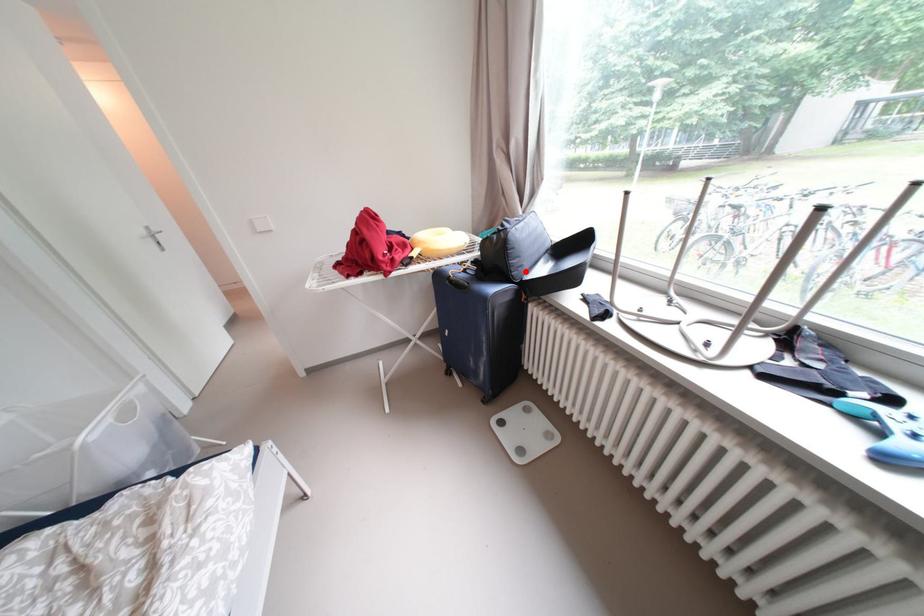
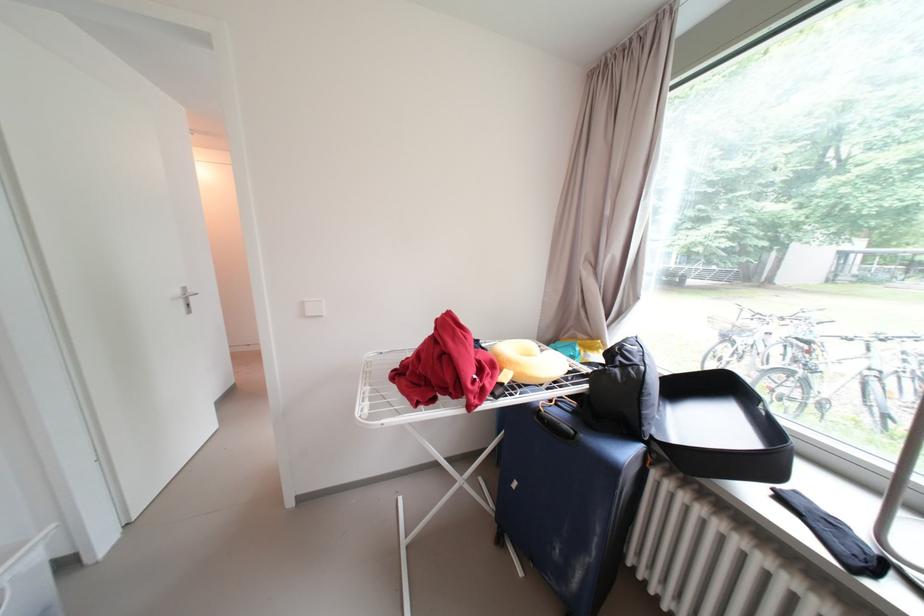
Question: I am providing you with two images of the same scene from different viewpoints. Image1 has a red point marked. In image2, the corresponding 3D location appears at what relative position? Reply with the corresponding letter.

Choices:
 (A) Closer
 (B) Farther

Answer: (B)